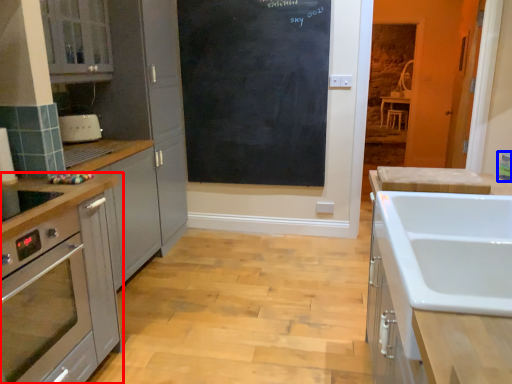
Question: Which object appears farthest to the camera in this image, cabinetry (highlighted by a red box) or appliance (highlighted by a blue box)?

Choices:
 (A) cabinetry
 (B) appliance

Answer: (B)